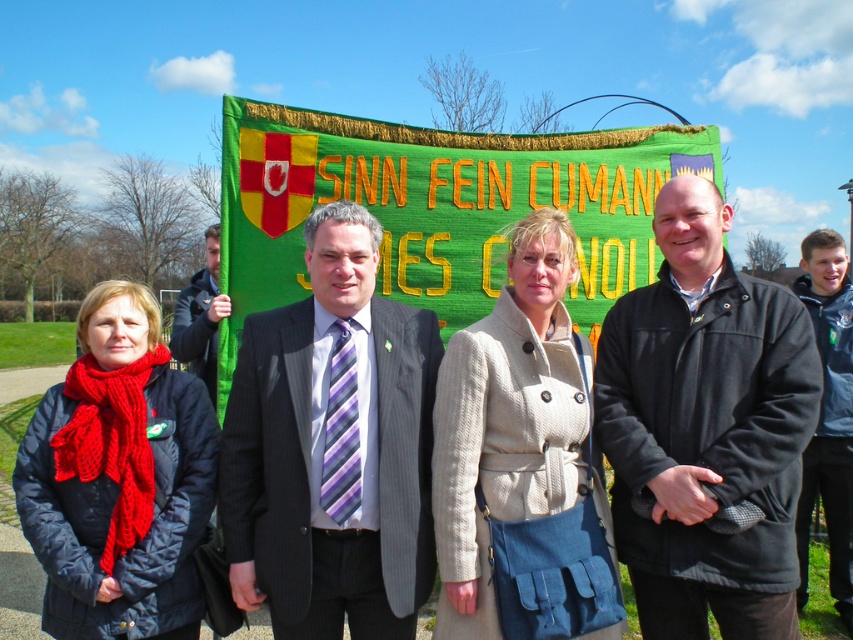
You are a photographer setting up for a group photo. You notice the green knitted banner at center and the knitted red scarf at left. Which object is positioned higher in the image?

The green knitted banner at center is located above the knitted red scarf at left, so it is positioned higher in the image.